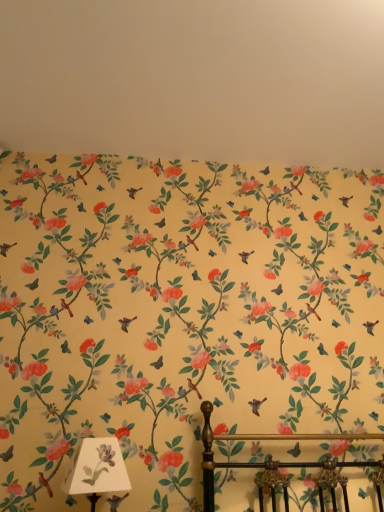
Question: Is white paper shade at lower left positioned beyond the bounds of yellow floral wallpaper at upper center?

Choices:
 (A) yes
 (B) no

Answer: (A)

Question: Does white paper shade at lower left have a larger size compared to yellow floral wallpaper at upper center?

Choices:
 (A) no
 (B) yes

Answer: (A)

Question: From a real-world perspective, does white paper shade at lower left stand above yellow floral wallpaper at upper center?

Choices:
 (A) yes
 (B) no

Answer: (B)

Question: Considering the relative sizes of white paper shade at lower left and yellow floral wallpaper at upper center in the image provided, is white paper shade at lower left taller than yellow floral wallpaper at upper center?

Choices:
 (A) no
 (B) yes

Answer: (B)

Question: Could you tell me if white paper shade at lower left is facing yellow floral wallpaper at upper center?

Choices:
 (A) no
 (B) yes

Answer: (A)

Question: Does white paper shade at lower left contain yellow floral wallpaper at upper center?

Choices:
 (A) no
 (B) yes

Answer: (A)

Question: Considering the relative sizes of yellow floral wallpaper at upper center and white paper shade at lower left in the image provided, is yellow floral wallpaper at upper center shorter than white paper shade at lower left?

Choices:
 (A) yes
 (B) no

Answer: (A)

Question: Is yellow floral wallpaper at upper center smaller than white paper shade at lower left?

Choices:
 (A) no
 (B) yes

Answer: (A)

Question: Does yellow floral wallpaper at upper center have a lesser width compared to white paper shade at lower left?

Choices:
 (A) yes
 (B) no

Answer: (B)

Question: Considering the relative positions of yellow floral wallpaper at upper center and white paper shade at lower left in the image provided, is yellow floral wallpaper at upper center to the left of white paper shade at lower left from the viewer's perspective?

Choices:
 (A) yes
 (B) no

Answer: (B)

Question: From a real-world perspective, is yellow floral wallpaper at upper center on white paper shade at lower left?

Choices:
 (A) no
 (B) yes

Answer: (B)

Question: From the image's perspective, is yellow floral wallpaper at upper center over white paper shade at lower left?

Choices:
 (A) no
 (B) yes

Answer: (B)

Question: In the image, is yellow floral wallpaper at upper center positioned in front of or behind white paper shade at lower left?

Choices:
 (A) behind
 (B) front

Answer: (A)